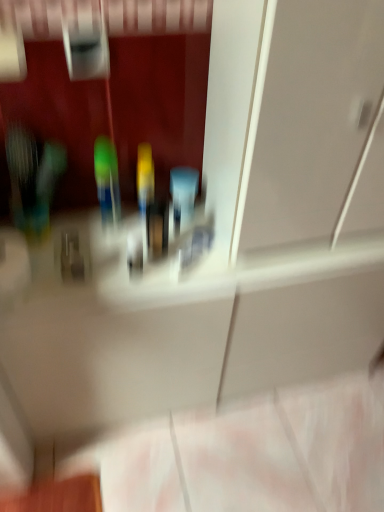
Locate an element on the screen. The image size is (384, 512). green plastic toothbrush at center is located at coordinates (107, 180).

The width and height of the screenshot is (384, 512). What do you see at coordinates (107, 180) in the screenshot?
I see `green plastic toothbrush at center` at bounding box center [107, 180].

I want to click on transparent glass door at upper center, so click(315, 127).

What do you see at coordinates (315, 127) in the screenshot? The height and width of the screenshot is (512, 384). I see `transparent glass door at upper center` at bounding box center [315, 127].

This screenshot has height=512, width=384. Find the location of `green plastic toothbrush at center`. green plastic toothbrush at center is located at coordinates (107, 180).

From the picture: Is transparent glass door at upper center to the right of green plastic toothbrush at center from the viewer's perspective?

Yes.

Does transparent glass door at upper center lie in front of green plastic toothbrush at center?

That is True.

Does point (286, 190) come behind point (111, 146)?

That is False.

Based on the photo, from the image's perspective, between transparent glass door at upper center and green plastic toothbrush at center, who is located below?

green plastic toothbrush at center, from the image's perspective.

From a real-world perspective, is transparent glass door at upper center positioned above or below green plastic toothbrush at center?

Clearly, from a real-world perspective, transparent glass door at upper center is above green plastic toothbrush at center.

Does transparent glass door at upper center have a greater width compared to green plastic toothbrush at center?

Yes, transparent glass door at upper center is wider than green plastic toothbrush at center.

Does transparent glass door at upper center have a greater height compared to green plastic toothbrush at center?

Yes.

In the scene shown: Does transparent glass door at upper center have a larger size compared to green plastic toothbrush at center?

Correct, transparent glass door at upper center is larger in size than green plastic toothbrush at center.

Looking at this image, would you say transparent glass door at upper center contains green plastic toothbrush at center?

Definitely not — green plastic toothbrush at center is not inside transparent glass door at upper center.

Are transparent glass door at upper center and green plastic toothbrush at center beside each other?

No, transparent glass door at upper center is not beside green plastic toothbrush at center.

Could you tell me if transparent glass door at upper center is facing green plastic toothbrush at center?

No.

Can you tell me how much transparent glass door at upper center and green plastic toothbrush at center differ in facing direction?

transparent glass door at upper center and green plastic toothbrush at center are facing 1.99 degrees away from each other.

What are the coordinates of `glass door that appears above the green plastic toothbrush at center (from the image's perspective)` in the screenshot? It's located at pyautogui.click(x=315, y=127).

Would you say green plastic toothbrush at center is to the left or to the right of transparent glass door at upper center in the picture?

Clearly, green plastic toothbrush at center is on the left of transparent glass door at upper center in the image.

Considering their positions, is green plastic toothbrush at center located in front of or behind transparent glass door at upper center?

In the image, green plastic toothbrush at center appears behind transparent glass door at upper center.

Does point (107, 196) come behind point (327, 8)?

Yes, it is.

From the image's perspective, is green plastic toothbrush at center on transparent glass door at upper center?

No, from the image's perspective, green plastic toothbrush at center is not over transparent glass door at upper center.

From the picture: From a real-world perspective, which object stands above the other?

In real-world perspective, transparent glass door at upper center is above.

Which object is thinner, green plastic toothbrush at center or transparent glass door at upper center?

green plastic toothbrush at center is thinner.

Considering the sizes of green plastic toothbrush at center and transparent glass door at upper center in the image, is green plastic toothbrush at center taller or shorter than transparent glass door at upper center?

green plastic toothbrush at center is shorter than transparent glass door at upper center.

Who is bigger, green plastic toothbrush at center or transparent glass door at upper center?

transparent glass door at upper center is bigger.

Is transparent glass door at upper center completely or partially inside green plastic toothbrush at center?

No, transparent glass door at upper center is located outside of green plastic toothbrush at center.

Is green plastic toothbrush at center not close to transparent glass door at upper center?

green plastic toothbrush at center is near transparent glass door at upper center, not far away.

Is green plastic toothbrush at center oriented away from transparent glass door at upper center?

No, green plastic toothbrush at center's orientation is not away from transparent glass door at upper center.

How many degrees apart are the facing directions of green plastic toothbrush at center and transparent glass door at upper center?

There is a 1.99-degree angle between the facing directions of green plastic toothbrush at center and transparent glass door at upper center.

Measure the distance from green plastic toothbrush at center to transparent glass door at upper center.

green plastic toothbrush at center is 17.47 inches from transparent glass door at upper center.

In order to click on toiletry below the transparent glass door at upper center (from a real-world perspective) in this screenshot , I will do `click(107, 180)`.

Find the location of a particular element. toiletry to the left of transparent glass door at upper center is located at coordinates coord(107,180).

Locate an element on the screen. Image resolution: width=384 pixels, height=512 pixels. glass door that appears above the green plastic toothbrush at center (from the image's perspective) is located at coordinates (315, 127).